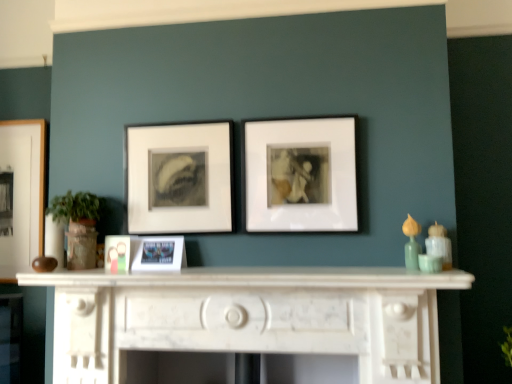
Question: Does white matte picture frame at center, marked as the 1th picture frame in a right-to-left arrangement, appear on the left side of matte white frame at center, the 4th picture frame when ordered from left to right?

Choices:
 (A) yes
 (B) no

Answer: (B)

Question: Is white matte picture frame at center, marked as the 1th picture frame in a right-to-left arrangement, at the right side of matte white frame at center, the 4th picture frame when ordered from left to right?

Choices:
 (A) no
 (B) yes

Answer: (B)

Question: Would you say matte white frame at center, the 4th picture frame when ordered from left to right, is part of white matte picture frame at center, which is the 5th picture frame in back-to-front order,'s contents?

Choices:
 (A) no
 (B) yes

Answer: (A)

Question: From the image's perspective, does white matte picture frame at center, marked as the 1th picture frame in a right-to-left arrangement, appear lower than matte white frame at center, the 4th picture frame positioned from the front?

Choices:
 (A) no
 (B) yes

Answer: (A)

Question: Is white matte picture frame at center, which is the 5th picture frame in back-to-front order, completely or partially outside of matte white frame at center, arranged as the second picture frame when viewed from the right?

Choices:
 (A) yes
 (B) no

Answer: (A)

Question: Considering their positions, is matte plastic photo frame at center, which appears as the 4th picture frame when viewed from the right, located in front of or behind matte white frame at center, which is the second picture frame in back-to-front order?

Choices:
 (A) front
 (B) behind

Answer: (A)

Question: From a real-world perspective, is matte plastic photo frame at center, which appears as the 4th picture frame when viewed from the right, positioned above or below matte white frame at center, the 4th picture frame positioned from the front?

Choices:
 (A) above
 (B) below

Answer: (B)

Question: Is matte plastic photo frame at center, marked as the third picture frame in a front-to-back arrangement, to the left or to the right of matte white frame at center, arranged as the second picture frame when viewed from the right, in the image?

Choices:
 (A) left
 (B) right

Answer: (A)

Question: Considering the positions of matte plastic photo frame at center, marked as the third picture frame in a front-to-back arrangement, and matte white frame at center, which is the second picture frame in back-to-front order, in the image, is matte plastic photo frame at center, marked as the third picture frame in a front-to-back arrangement, taller or shorter than matte white frame at center, which is the second picture frame in back-to-front order,?

Choices:
 (A) short
 (B) tall

Answer: (A)

Question: Relative to matte plastic photo frame at center, marked as the third picture frame in a front-to-back arrangement, is metallic silver photo frame at center, the 3th picture frame positioned from the left, in front or behind?

Choices:
 (A) front
 (B) behind

Answer: (A)

Question: Considering the positions of metallic silver photo frame at center, acting as the 3th picture frame starting from the right, and matte plastic photo frame at center, acting as the 3th picture frame starting from the back, in the image, is metallic silver photo frame at center, acting as the 3th picture frame starting from the right, wider or thinner than matte plastic photo frame at center, acting as the 3th picture frame starting from the back,?

Choices:
 (A) thin
 (B) wide

Answer: (B)

Question: Visually, is metallic silver photo frame at center, which appears as the 4th picture frame when viewed from the back, positioned to the left or to the right of matte plastic photo frame at center, marked as the third picture frame in a front-to-back arrangement?

Choices:
 (A) right
 (B) left

Answer: (A)

Question: From a real-world perspective, is metallic silver photo frame at center, which appears as the 4th picture frame when viewed from the back, above or below matte plastic photo frame at center, which appears as the 4th picture frame when viewed from the right?

Choices:
 (A) above
 (B) below

Answer: (B)

Question: From a real-world perspective, is white matte picture frame at center, which is the 5th picture frame in back-to-front order, positioned above or below white marble fireplace at center?

Choices:
 (A) above
 (B) below

Answer: (A)

Question: Is white matte picture frame at center, the first picture frame in the front-to-back sequence, inside or outside of white marble fireplace at center?

Choices:
 (A) inside
 (B) outside

Answer: (B)